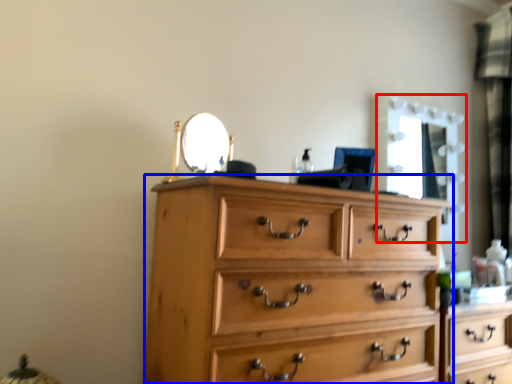
Question: Which object appears farthest to the camera in this image, mirror (highlighted by a red box) or chest of drawers (highlighted by a blue box)?

Choices:
 (A) mirror
 (B) chest of drawers

Answer: (A)